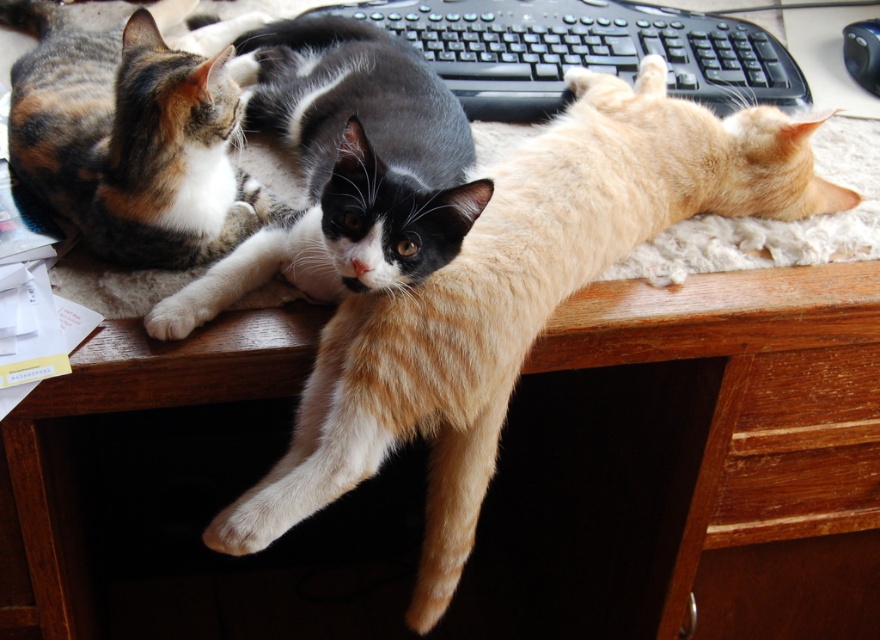
Question: Does calico fur cat at center have a larger size compared to wooden drawer at lower right?

Choices:
 (A) yes
 (B) no

Answer: (A)

Question: Which point is closer to the camera taking this photo?

Choices:
 (A) (541, 157)
 (B) (448, 76)
 (C) (55, 45)
 (D) (308, 16)

Answer: (A)

Question: Which of the following is the closest to the observer?

Choices:
 (A) orange tabby cat at center
 (B) wooden drawer at lower right

Answer: (A)

Question: Can you confirm if black plastic keyboard at upper center is smaller than wooden drawer at lower right?

Choices:
 (A) yes
 (B) no

Answer: (B)

Question: Which point appears farthest from the camera in this image?

Choices:
 (A) (670, 16)
 (B) (444, 252)

Answer: (A)

Question: Does black plastic keyboard at upper center have a larger size compared to wooden drawer at lower right?

Choices:
 (A) yes
 (B) no

Answer: (A)